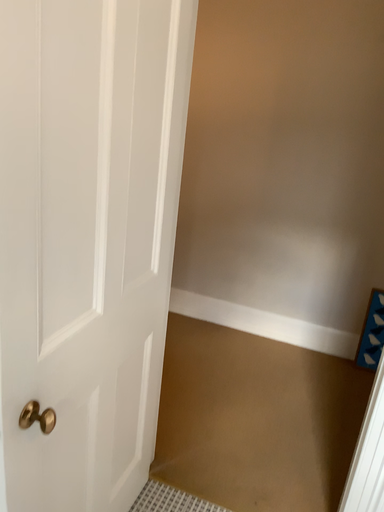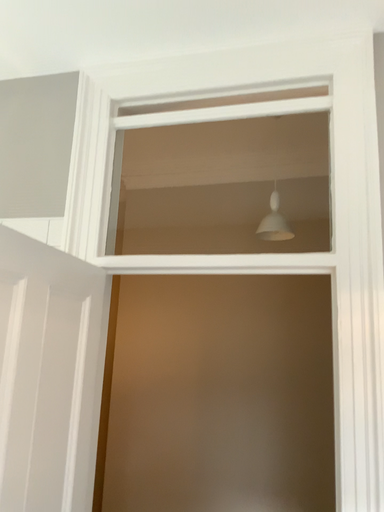
Question: How did the camera likely rotate when shooting the video?

Choices:
 (A) rotated upward
 (B) rotated downward

Answer: (A)